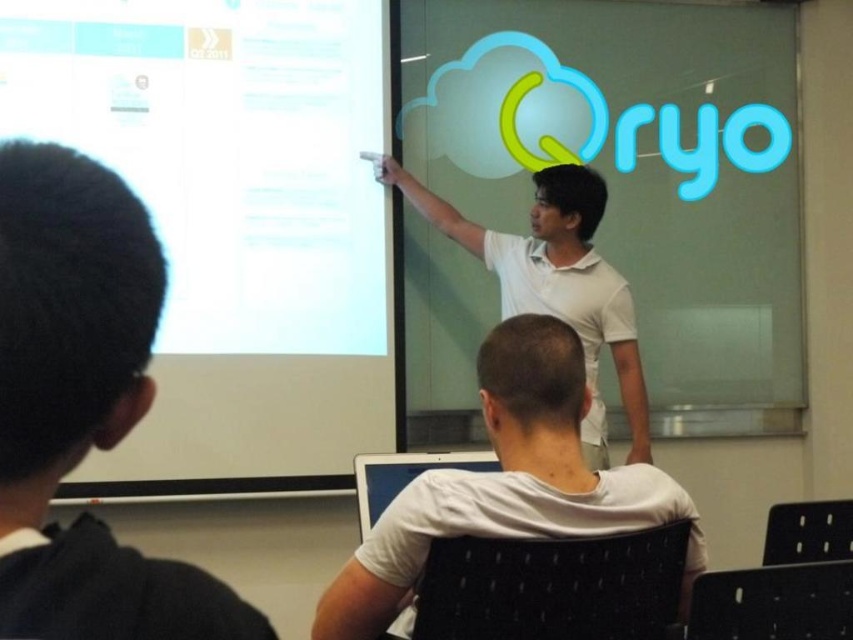
Is transparent glass at upper center to the right of black hair at left from the viewer's perspective?

Yes, transparent glass at upper center is to the right of black hair at left.

Image resolution: width=853 pixels, height=640 pixels. I want to click on transparent glass at upper center, so click(640, 173).

Where is `transparent glass at upper center`? The width and height of the screenshot is (853, 640). transparent glass at upper center is located at coordinates (640, 173).

Is point (605, 36) less distant than point (515, 278)?

No, it is behind (515, 278).

Which is behind, point (682, 154) or point (582, 266)?

The point (682, 154) is behind.

Where is `transparent glass at upper center`? The height and width of the screenshot is (640, 853). transparent glass at upper center is located at coordinates (640, 173).

Which is above, white glossy projection screen at upper left or white matte shirt at upper center?

white glossy projection screen at upper left

Who is positioned more to the left, white glossy projection screen at upper left or white matte shirt at upper center?

From the viewer's perspective, white glossy projection screen at upper left appears more on the left side.

Measure the distance between point (196, 250) and camera.

Point (196, 250) is 2.74 meters from camera.

The image size is (853, 640). I want to click on white glossy projection screen at upper left, so click(234, 225).